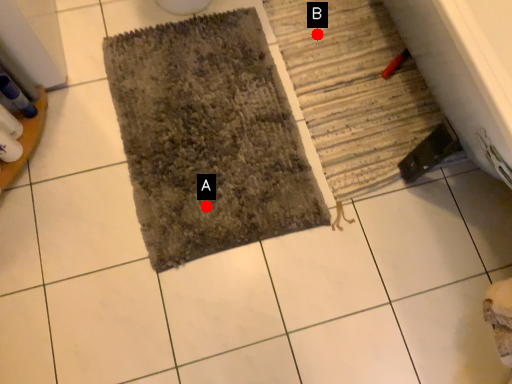
Question: Two points are circled on the image, labeled by A and B beside each circle. Which point is farther from the camera taking this photo?

Choices:
 (A) A is further
 (B) B is further

Answer: (B)